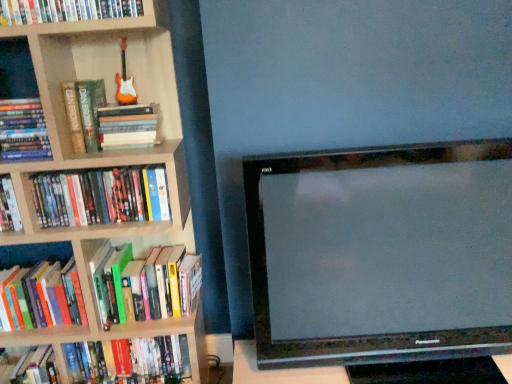
Question: Is hardcover book at left, which is counted as the third book, starting from the bottom, bigger than hardcover book at left, marked as the first book in a bottom-to-top arrangement?

Choices:
 (A) yes
 (B) no

Answer: (B)

Question: Is hardcover book at left, which is counted as the third book, starting from the bottom, to the right of hardcover book at left, the seventh book from the top, from the viewer's perspective?

Choices:
 (A) yes
 (B) no

Answer: (B)

Question: From a real-world perspective, does hardcover book at left, which is counted as the third book, starting from the bottom, sit lower than hardcover book at left, marked as the first book in a bottom-to-top arrangement?

Choices:
 (A) no
 (B) yes

Answer: (A)

Question: Does hardcover book at left, the fifth book in the top-to-bottom sequence, have a lesser width compared to hardcover book at left, marked as the first book in a bottom-to-top arrangement?

Choices:
 (A) yes
 (B) no

Answer: (A)

Question: Considering the relative sizes of hardcover book at left, the fifth book in the top-to-bottom sequence, and hardcover book at left, marked as the first book in a bottom-to-top arrangement, in the image provided, is hardcover book at left, the fifth book in the top-to-bottom sequence, shorter than hardcover book at left, marked as the first book in a bottom-to-top arrangement,?

Choices:
 (A) no
 (B) yes

Answer: (B)

Question: Considering the positions of point (501, 359) and point (126, 286), is point (501, 359) closer or farther from the camera than point (126, 286)?

Choices:
 (A) farther
 (B) closer

Answer: (B)

Question: Relative to hardcover book at left, the 6th book viewed from the top, is metallic silver table at lower right in front or behind?

Choices:
 (A) behind
 (B) front

Answer: (B)

Question: Is metallic silver table at lower right situated inside hardcover book at left, the 6th book viewed from the top, or outside?

Choices:
 (A) outside
 (B) inside

Answer: (A)

Question: Would you say metallic silver table at lower right is to the left or to the right of hardcover book at left, which is the second book from bottom to top, in the picture?

Choices:
 (A) left
 (B) right

Answer: (B)

Question: From the image's perspective, is metallic silver table at lower right positioned above or below hardcover book at upper left, which is the 7th book from bottom to top?

Choices:
 (A) below
 (B) above

Answer: (A)

Question: In terms of width, does metallic silver table at lower right look wider or thinner when compared to hardcover book at upper left, which is the 7th book from bottom to top?

Choices:
 (A) thin
 (B) wide

Answer: (B)

Question: In terms of size, does metallic silver table at lower right appear bigger or smaller than hardcover book at upper left, positioned as the first book in top-to-bottom order?

Choices:
 (A) big
 (B) small

Answer: (A)

Question: Is metallic silver table at lower right in front of or behind hardcover book at upper left, which is the 7th book from bottom to top, in the image?

Choices:
 (A) front
 (B) behind

Answer: (A)

Question: Considering the positions of hardcover book at left, which ranks as the 5th book in bottom-to-top order, and hardcover book at left, the fourth book from the bottom, in the image, is hardcover book at left, which ranks as the 5th book in bottom-to-top order, taller or shorter than hardcover book at left, the fourth book from the bottom,?

Choices:
 (A) short
 (B) tall

Answer: (A)

Question: Visually, is hardcover book at left, which ranks as the 5th book in bottom-to-top order, positioned to the left or to the right of hardcover book at left, the fourth book from the bottom?

Choices:
 (A) right
 (B) left

Answer: (B)